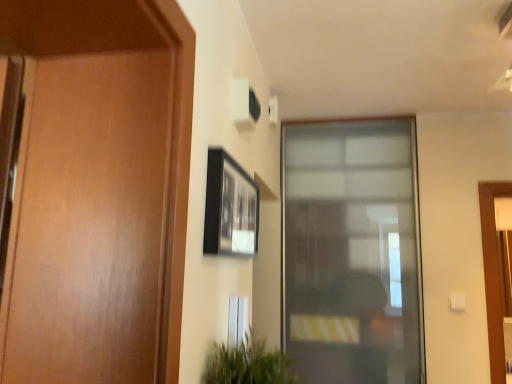
Question: Should I look upward or downward to see green leafy plant at lower center?

Choices:
 (A) up
 (B) down

Answer: (B)

Question: Can you confirm if transparent glass window at center is bigger than black matte picture frame at upper center?

Choices:
 (A) no
 (B) yes

Answer: (B)

Question: Is black matte picture frame at upper center located within transparent glass window at center?

Choices:
 (A) no
 (B) yes

Answer: (A)

Question: Is transparent glass window at center positioned behind black matte picture frame at upper center?

Choices:
 (A) yes
 (B) no

Answer: (A)

Question: Does transparent glass window at center turn towards black matte picture frame at upper center?

Choices:
 (A) yes
 (B) no

Answer: (A)

Question: Are transparent glass window at center and black matte picture frame at upper center making contact?

Choices:
 (A) no
 (B) yes

Answer: (A)

Question: From the image's perspective, does transparent glass window at center appear higher than black matte picture frame at upper center?

Choices:
 (A) yes
 (B) no

Answer: (B)

Question: Is green leafy plant at lower center taller than black matte picture frame at upper center?

Choices:
 (A) yes
 (B) no

Answer: (B)

Question: Considering the relative positions of green leafy plant at lower center and black matte picture frame at upper center in the image provided, is green leafy plant at lower center to the left of black matte picture frame at upper center from the viewer's perspective?

Choices:
 (A) yes
 (B) no

Answer: (B)

Question: Is green leafy plant at lower center positioned far away from black matte picture frame at upper center?

Choices:
 (A) yes
 (B) no

Answer: (B)

Question: Is green leafy plant at lower center thinner than black matte picture frame at upper center?

Choices:
 (A) no
 (B) yes

Answer: (A)

Question: Does green leafy plant at lower center have a lesser height compared to black matte picture frame at upper center?

Choices:
 (A) yes
 (B) no

Answer: (A)

Question: Is green leafy plant at lower center positioned behind black matte picture frame at upper center?

Choices:
 (A) no
 (B) yes

Answer: (A)

Question: Is black matte picture frame at upper center touching green leafy plant at lower center?

Choices:
 (A) yes
 (B) no

Answer: (B)